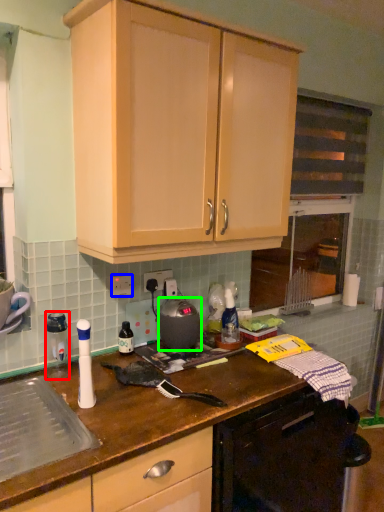
Question: Based on their relative distances, which object is nearer to appliance (highlighted by a red box)? Choose from electric outlet (highlighted by a blue box) and kitchen appliance (highlighted by a green box).

Choices:
 (A) electric outlet
 (B) kitchen appliance

Answer: (A)